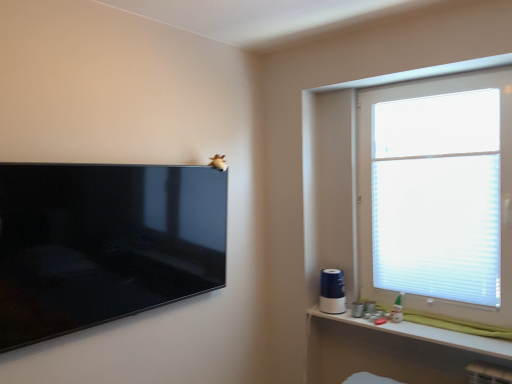
Question: Considering the relative positions of white plastic shelf at lower right and white translucent blinds at upper right in the image provided, is white plastic shelf at lower right to the left or to the right of white translucent blinds at upper right?

Choices:
 (A) left
 (B) right

Answer: (A)

Question: Is white plastic shelf at lower right bigger or smaller than white translucent blinds at upper right?

Choices:
 (A) big
 (B) small

Answer: (B)

Question: Which object is positioned closest to the matte black tv at upper left?

Choices:
 (A) white translucent blinds at upper right
 (B) white plastic shelf at lower right

Answer: (B)

Question: Which object is positioned farthest from the matte black tv at upper left?

Choices:
 (A) white translucent blinds at upper right
 (B) white plastic shelf at lower right

Answer: (A)